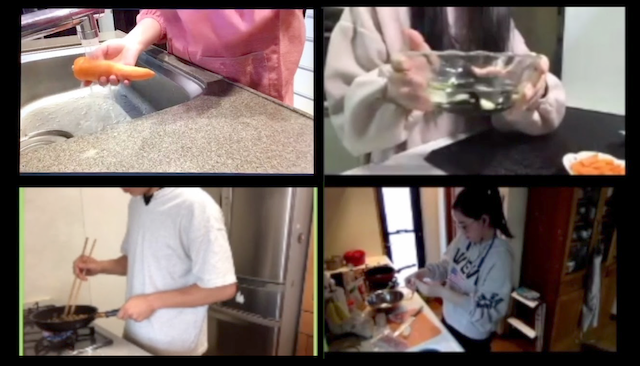
Where is `counter top`? counter top is located at coordinates (118, 342), (443, 337), (506, 155).